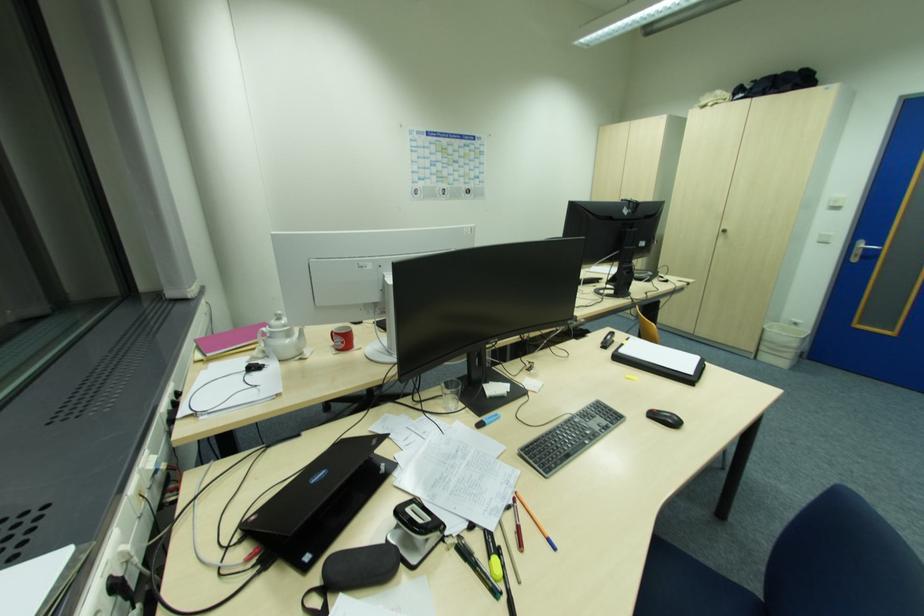
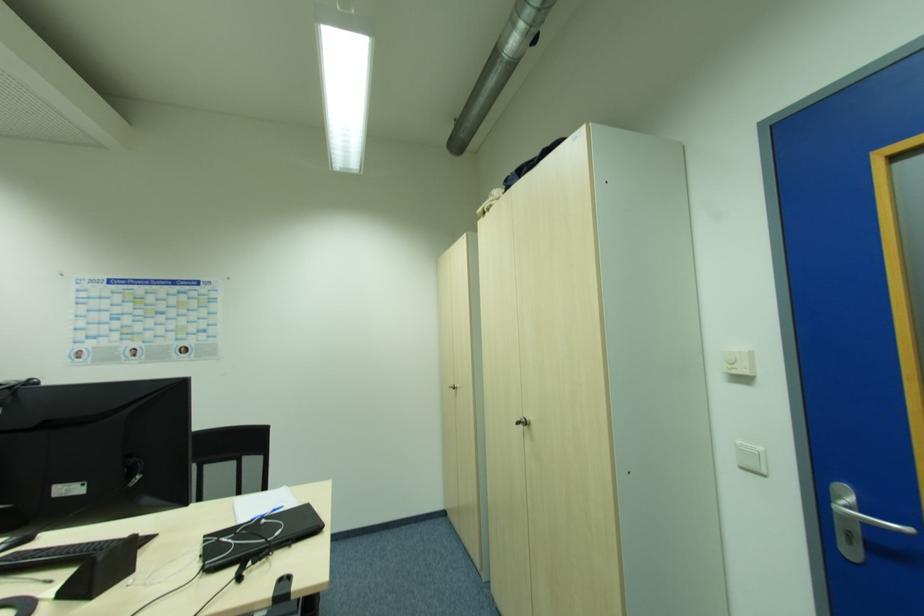
Find the pixel in the second image that matches point 726,232 in the first image.

(526, 424)